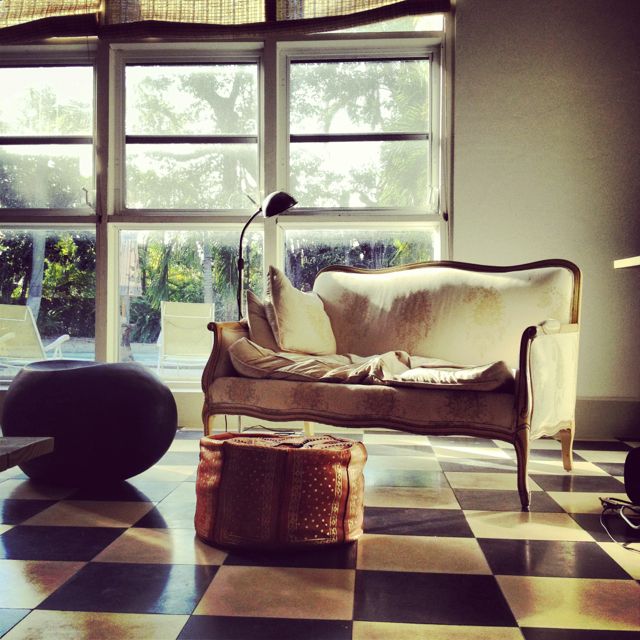
Where is `stool`? stool is located at coordinates (278, 454).